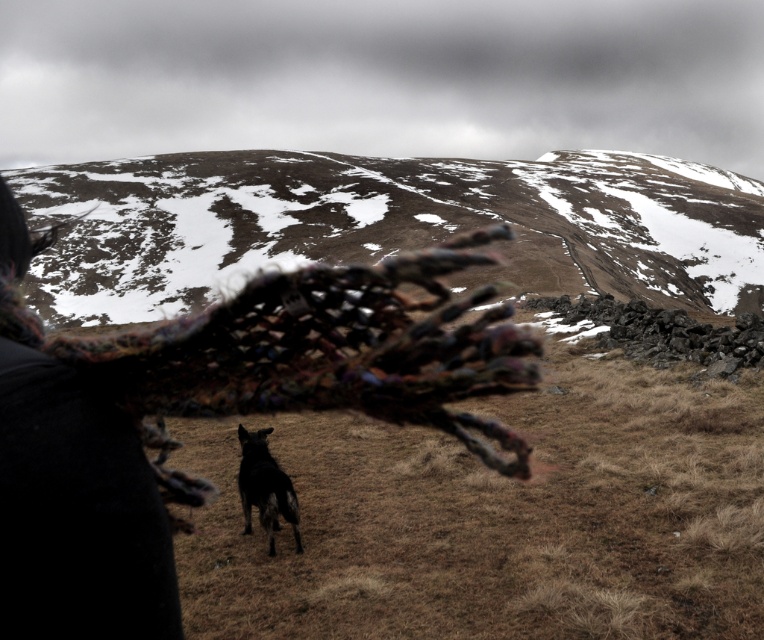
You are a hiker planning to take a photo of the snowy brown mountain at upper center and the black fur dog at center. Which object in the frame is taller?

The snowy brown mountain at upper center is taller than the black fur dog at center.

You are a photographer trying to capture the black fur dog at center in your shot. The multicolored knitted shawl at center is blocking your view. Can you move the shawl to the side to get a clear shot of the dog?

The multicolored knitted shawl at center is located above the black fur dog at center, so moving it to the side would allow you to see the dog clearly below.

You are a photographer trying to capture a clear shot of the black fur dog at center. However, the multicolored knitted shawl at center is blocking your view. Can you adjust your position to see the dog without the shawl obstructing it?

The multicolored knitted shawl at center is closer to the viewer than black fur dog at center, so moving your position slightly to the side or adjusting your angle might allow you to see the dog without the shawl blocking the view.